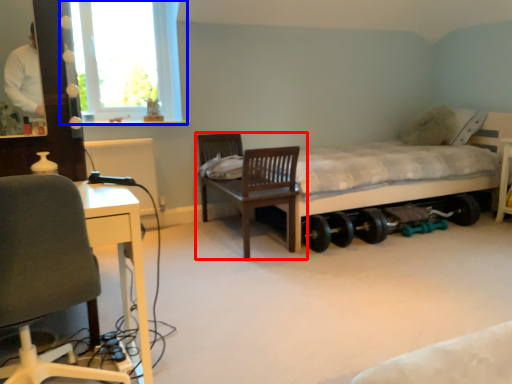
Question: Among these objects, which one is nearest to the camera, chair (highlighted by a red box) or window (highlighted by a blue box)?

Choices:
 (A) chair
 (B) window

Answer: (A)